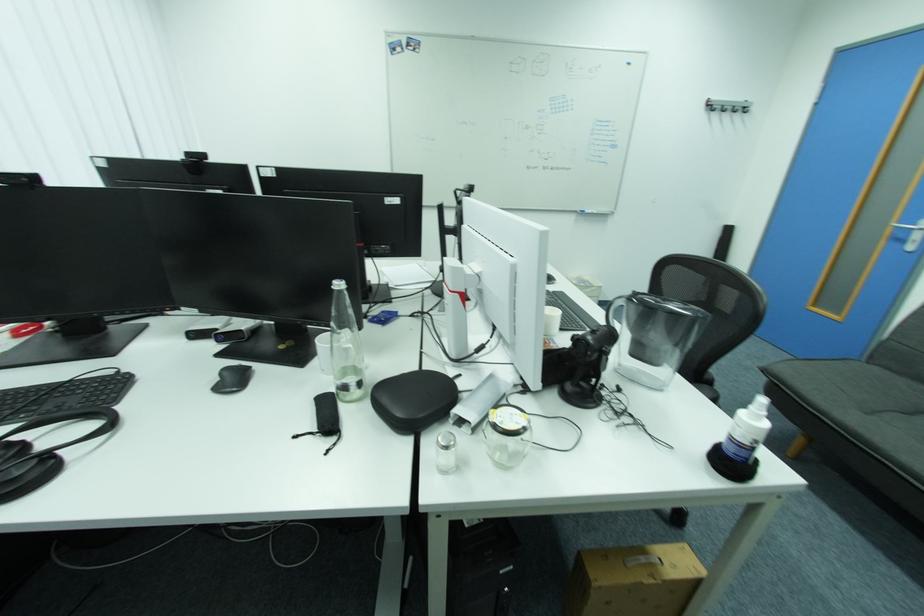
Describe the element at coordinates (754, 405) in the screenshot. I see `a bottle pump top` at that location.